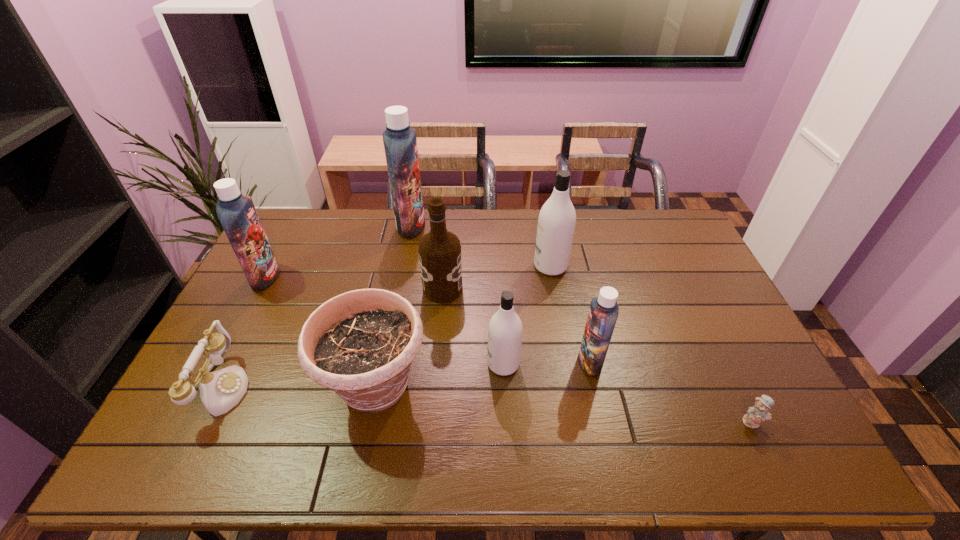
I want to click on the tallest shampoo, so click(400, 142).

This screenshot has height=540, width=960. Find the location of `the farthest blue shampoo`. the farthest blue shampoo is located at coordinates (400, 142).

The image size is (960, 540). Find the location of `the leftmost blue shampoo`. the leftmost blue shampoo is located at coordinates (237, 214).

The height and width of the screenshot is (540, 960). I want to click on the second smallest blue shampoo, so click(237, 214).

Find the location of a particular element. the bigger white shampoo is located at coordinates (556, 223).

The height and width of the screenshot is (540, 960). Identify the location of the right white shampoo. (556, 223).

Locate an element on the screen. This screenshot has height=540, width=960. alcohol is located at coordinates (440, 258).

Find the location of a particular element. the rightmost blue shampoo is located at coordinates (603, 313).

The width and height of the screenshot is (960, 540). I want to click on the nearest blue shampoo, so click(603, 313).

Find the location of a particular element. This screenshot has width=960, height=540. the nearer white shampoo is located at coordinates (505, 327).